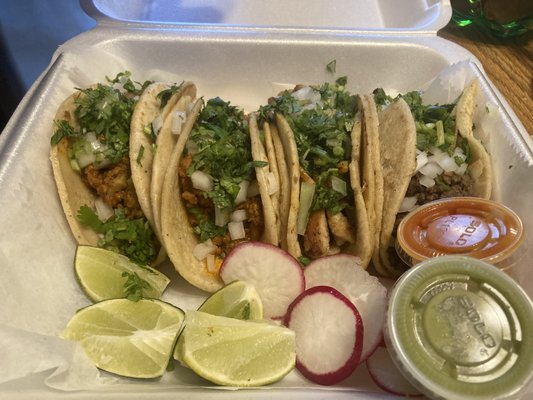
What are the coordinates of `styrofoam square container` in the screenshot? It's located at (249, 68), (281, 13).